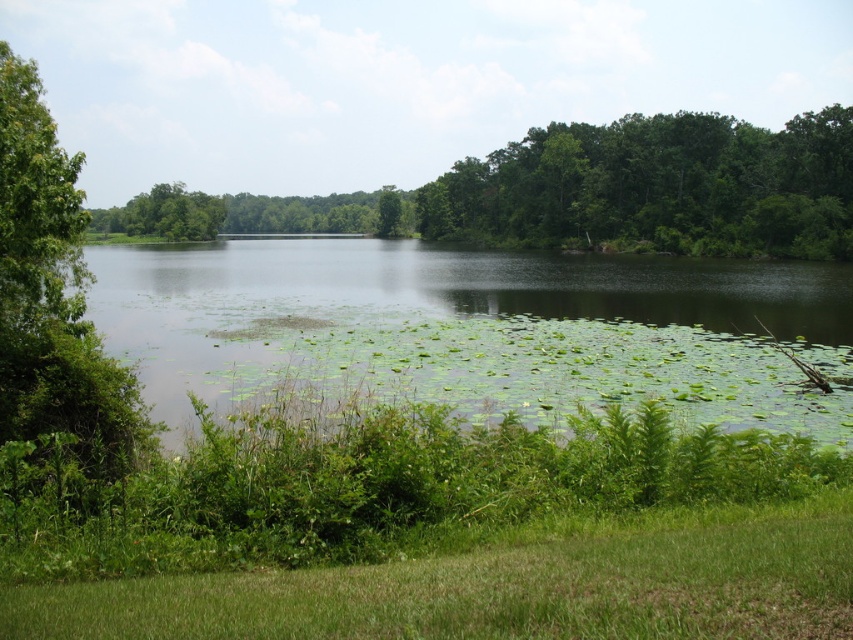
Looking at this image, does green leafy water at center have a greater height compared to green leafy tree at center?

No.

Does green leafy water at center appear under green leafy tree at center?

Yes, green leafy water at center is below green leafy tree at center.

Does point (407, 349) come farther from viewer compared to point (799, 170)?

That is False.

I want to click on green leafy water at center, so click(474, 330).